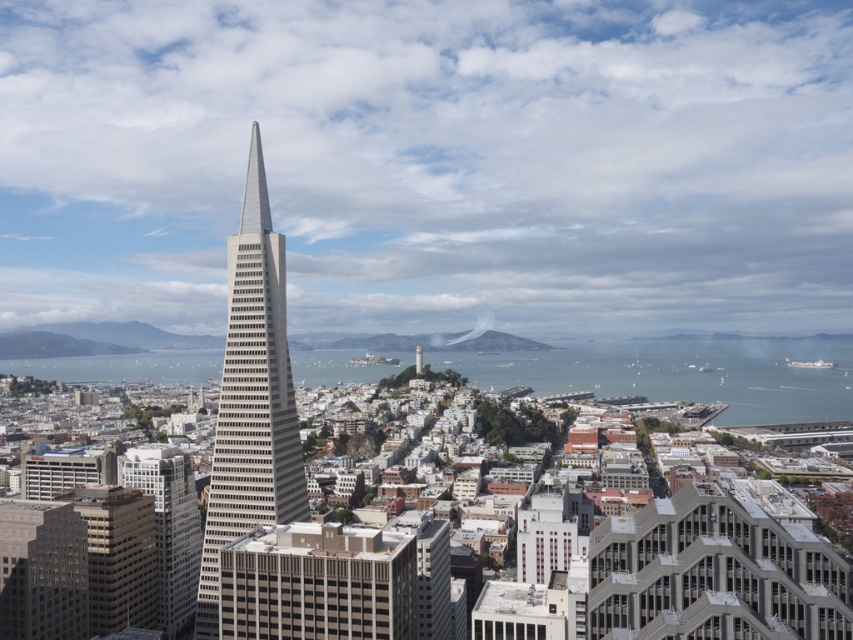
Identify the location of blue water at center. The image size is (853, 640). (680, 374).

Which is above, blue water at center or white concrete tower at center?

white concrete tower at center is higher up.

Measure the distance between blue water at center and camera.

blue water at center and camera are 615.62 meters apart from each other.

I want to click on blue water at center, so click(680, 374).

Does matte glass skyscraper at lower left have a smaller size compared to matte gray building at lower left?

Correct, matte glass skyscraper at lower left occupies less space than matte gray building at lower left.

Is matte glass skyscraper at lower left to the right of matte gray building at lower left from the viewer's perspective?

In fact, matte glass skyscraper at lower left is to the left of matte gray building at lower left.

This screenshot has width=853, height=640. What are the coordinates of `matte glass skyscraper at lower left` in the screenshot? It's located at (42, 570).

Is point (660, 372) positioned before point (154, 472)?

No, (660, 372) is behind (154, 472).

Can you confirm if blue water at center is wider than gray concrete building at lower left?

Indeed, blue water at center has a greater width compared to gray concrete building at lower left.

This screenshot has height=640, width=853. Identify the location of blue water at center. coord(680,374).